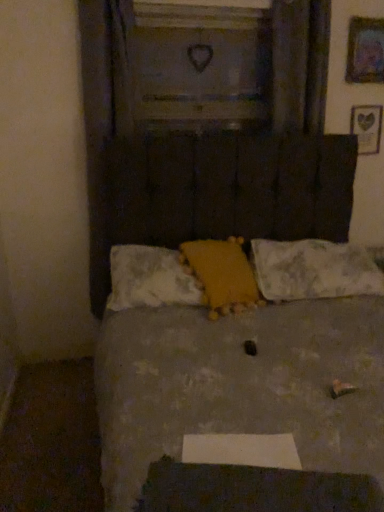
Question: From the image's perspective, is wooden heart at upper right, the 1th picture frame in the back-to-front sequence, located above yellow fabric pillow at center, which is counted as the first pillow, starting from the left?

Choices:
 (A) yes
 (B) no

Answer: (A)

Question: Can you confirm if wooden heart at upper right, positioned as the second picture frame in top-to-bottom order, is wider than yellow fabric pillow at center, which is counted as the third pillow, starting from the right?

Choices:
 (A) yes
 (B) no

Answer: (B)

Question: Is wooden heart at upper right, the 1th picture frame in the back-to-front sequence, outside of yellow fabric pillow at center, which is counted as the third pillow, starting from the right?

Choices:
 (A) yes
 (B) no

Answer: (A)

Question: Does wooden heart at upper right, the 2th picture frame from the front, have a smaller size compared to yellow fabric pillow at center, which is counted as the third pillow, starting from the right?

Choices:
 (A) no
 (B) yes

Answer: (B)

Question: Is wooden heart at upper right, the 1th picture frame in the bottom-to-top sequence, closer to camera compared to yellow fabric pillow at center, which is counted as the first pillow, starting from the left?

Choices:
 (A) no
 (B) yes

Answer: (A)

Question: Is wooden heart at upper right, the 1th picture frame in the back-to-front sequence, bigger than yellow fabric pillow at center, which is counted as the first pillow, starting from the left?

Choices:
 (A) no
 (B) yes

Answer: (A)

Question: Is yellow plush at center, acting as the second pillow starting from the left, bigger than white textured pillow at center, marked as the 3th pillow in a left-to-right arrangement?

Choices:
 (A) no
 (B) yes

Answer: (A)

Question: From a real-world perspective, is yellow plush at center, which ranks as the 2th pillow in right-to-left order, physically above white textured pillow at center, marked as the 3th pillow in a left-to-right arrangement?

Choices:
 (A) yes
 (B) no

Answer: (A)

Question: Is the depth of yellow plush at center, acting as the second pillow starting from the left, greater than that of white textured pillow at center, marked as the 3th pillow in a left-to-right arrangement?

Choices:
 (A) no
 (B) yes

Answer: (A)

Question: Can you confirm if yellow plush at center, acting as the second pillow starting from the left, is smaller than white textured pillow at center, which is the 1th pillow from right to left?

Choices:
 (A) no
 (B) yes

Answer: (B)

Question: Does yellow plush at center, acting as the second pillow starting from the left, touch white textured pillow at center, marked as the 3th pillow in a left-to-right arrangement?

Choices:
 (A) yes
 (B) no

Answer: (B)

Question: Is yellow fabric pillow at center, which is counted as the third pillow, starting from the right, surrounding textured gray bed at center?

Choices:
 (A) yes
 (B) no

Answer: (B)